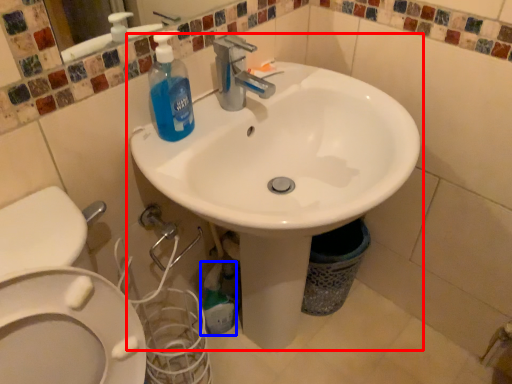
Question: Among these objects, which one is nearest to the camera, sink (highlighted by a red box) or cleaning product (highlighted by a blue box)?

Choices:
 (A) sink
 (B) cleaning product

Answer: (A)